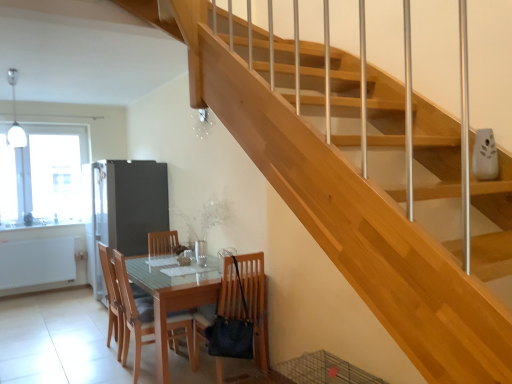
You are a GUI agent. You are given a task and a screenshot of the screen. Output one action in this format:
    pyautogui.click(x=<x>, y=<y>)
    Task: Click on the empty space that is ontop of transparent glass window at upper left
    
    Given the screenshot: What is the action you would take?
    pyautogui.click(x=50, y=124)